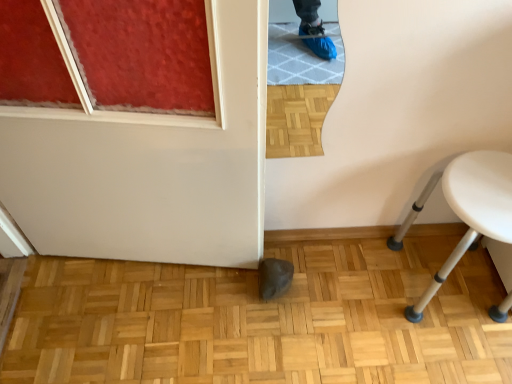
Question: Looking at the image, does white glossy door at lower center seem bigger or smaller compared to natural wood parquet floor at center?

Choices:
 (A) big
 (B) small

Answer: (A)

Question: Relative to natural wood parquet floor at center, is white glossy door at lower center in front or behind?

Choices:
 (A) behind
 (B) front

Answer: (B)

Question: Which is farther from the white glossy door at lower center?

Choices:
 (A) natural wood parquet floor at center
 (B) white plastic stool at lower right

Answer: (B)

Question: Considering the real-world distances, which object is farthest from the white glossy door at lower center?

Choices:
 (A) white plastic stool at lower right
 (B) natural wood parquet floor at center

Answer: (A)